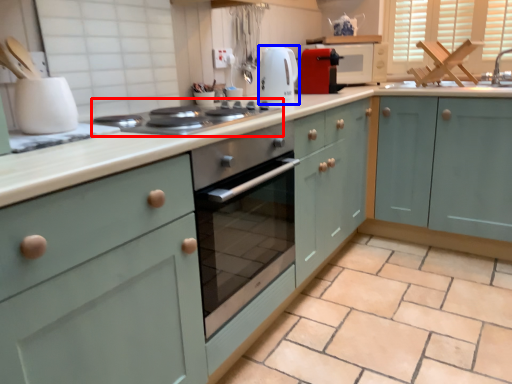
Question: Which object is closer to the camera taking this photo, home appliance (highlighted by a red box) or kitchen appliance (highlighted by a blue box)?

Choices:
 (A) home appliance
 (B) kitchen appliance

Answer: (A)